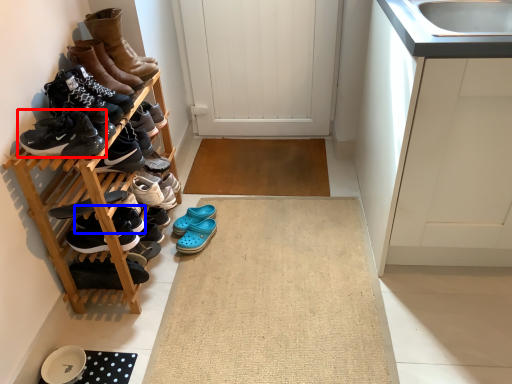
Question: Which object is further to the camera taking this photo, footwear (highlighted by a red box) or shoe (highlighted by a blue box)?

Choices:
 (A) footwear
 (B) shoe

Answer: (B)